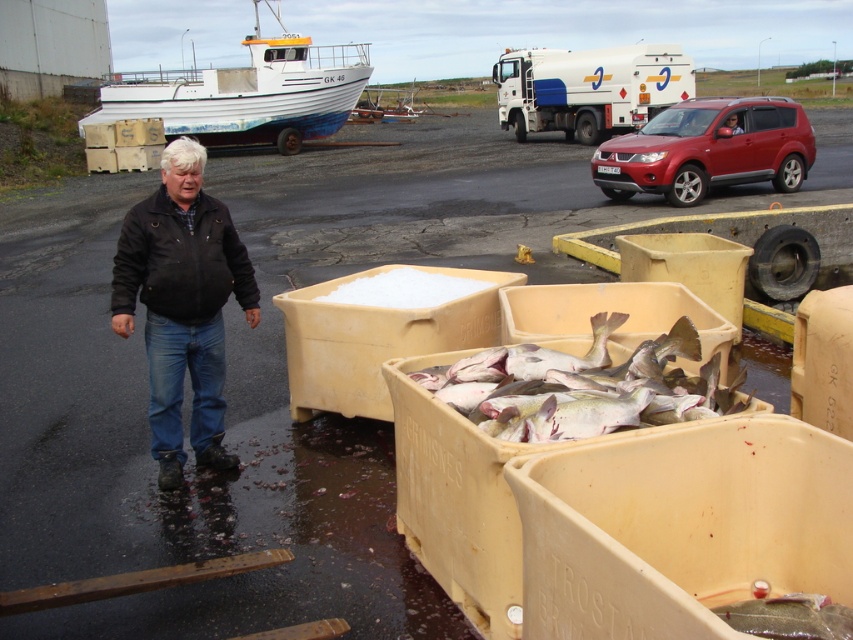
Between black leather jacket at left and pale pink flesh at center, which one has less height?

pale pink flesh at center

Is black leather jacket at left positioned before pale pink flesh at center?

No, it is not.

This screenshot has width=853, height=640. What do you see at coordinates (183, 305) in the screenshot? I see `black leather jacket at left` at bounding box center [183, 305].

I want to click on black leather jacket at left, so click(183, 305).

Can you confirm if black leather jacket at left is positioned to the left of white painted wood boat at upper left?

No, black leather jacket at left is not to the left of white painted wood boat at upper left.

Is black leather jacket at left smaller than white painted wood boat at upper left?

Yes.

The width and height of the screenshot is (853, 640). I want to click on black leather jacket at left, so click(x=183, y=305).

Which of these two, pale pink flesh at center or white painted wood boat at upper left, stands shorter?

Standing shorter between the two is pale pink flesh at center.

Locate an element on the screen. The image size is (853, 640). pale pink flesh at center is located at coordinates (583, 385).

At what (x,y) coordinates should I click in order to perform the action: click on pale pink flesh at center. Please return your answer as a coordinate pair (x, y). This screenshot has height=640, width=853. Looking at the image, I should click on (583, 385).

Where is `pale pink flesh at center`? The width and height of the screenshot is (853, 640). pale pink flesh at center is located at coordinates (583, 385).